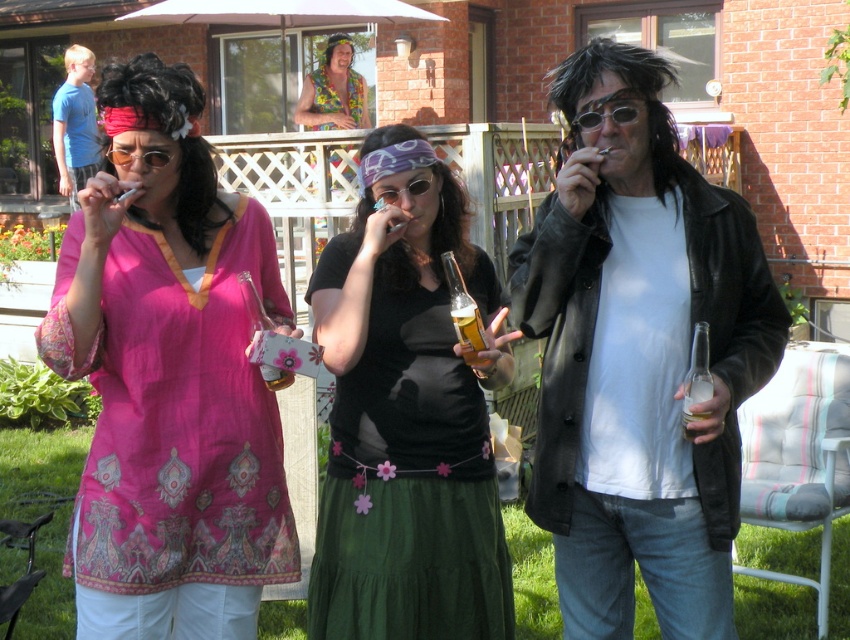
Where is the pink fabric shirt at center located in the image?

The pink fabric shirt at center is located at point 0.591 on the x axis and 0.200 on the y axis.

You are organizing a clothing donation drive and need to categorize the pink fabric shirt at center and the floral fabric shirt at upper center based on their sizes. Which shirt should be placed in the larger size section?

The pink fabric shirt at center is bigger than the floral fabric shirt at upper center, so it should be placed in the larger size section.

You are a photographer at the event and want to capture a photo of both the pink fabric shirt at center and the floral fabric shirt at upper center. Which of the two shirts should you focus on first to ensure both are in frame?

The pink fabric shirt at center is located below the floral fabric shirt at upper center, so you should focus on the floral fabric shirt at upper center first to ensure both are in frame.